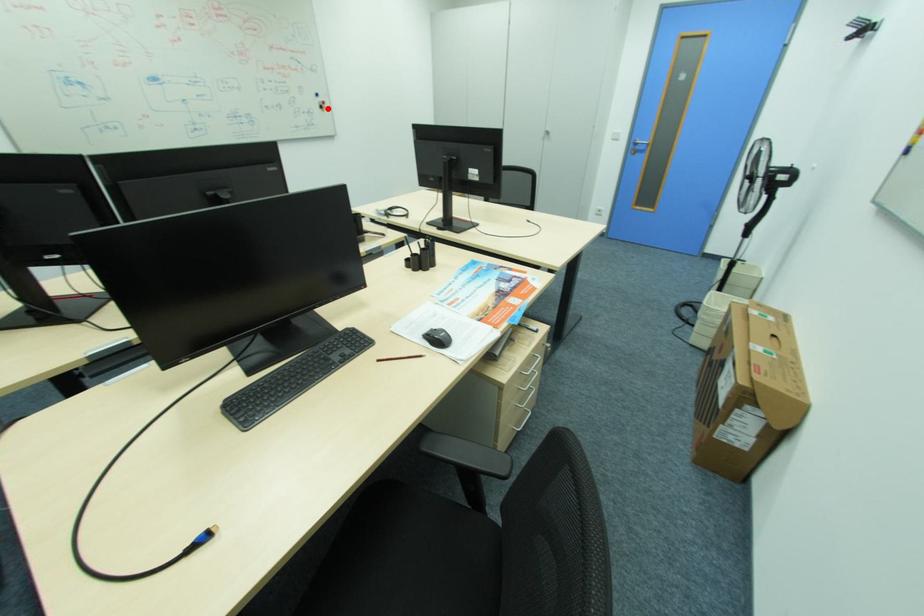
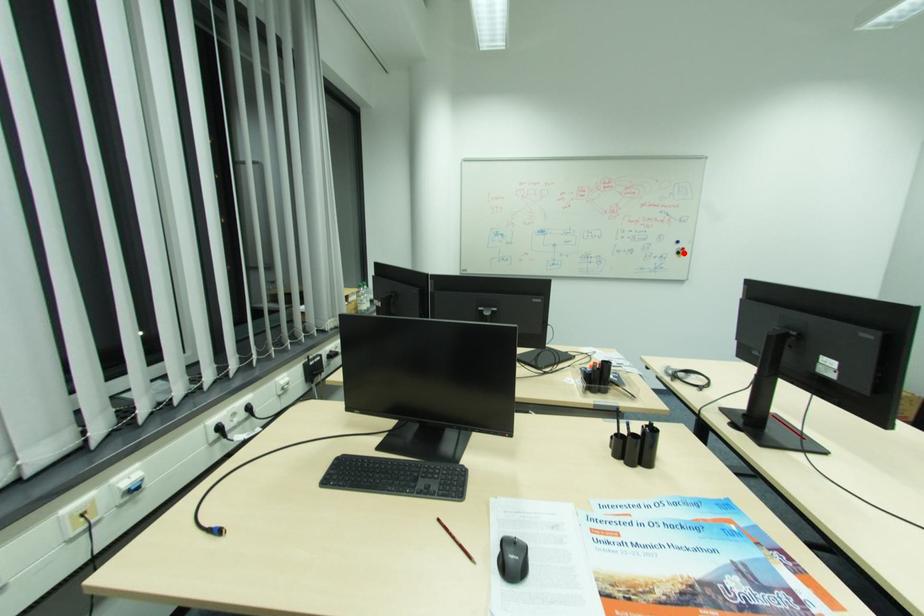
I am providing you with two images of the same scene from different viewpoints. A red point is marked on the first image and another point is marked on the second image. Do the highlighted points in image1 and image2 indicate the same real-world spot?

Yes